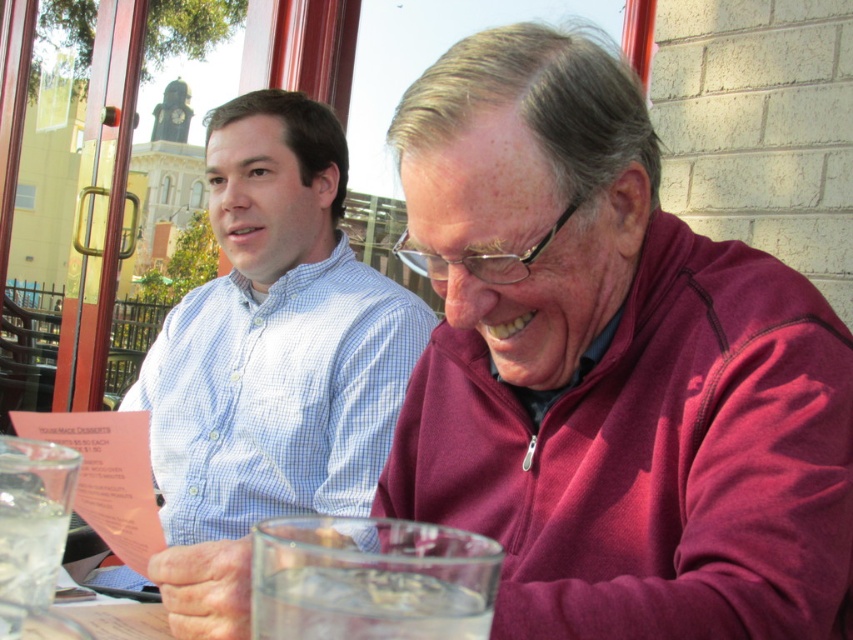
You are standing in the room where the two people are sitting. You want to look out the window to see the clock tower. Which direction should you look relative to the point at location (366, 604)?

The point at location (366, 604) is on clear glass water at lower center. To see the clock tower outside through the window, you should look upward from the point at location (366, 604) since the window is above and the clock tower is in the background beyond the window.

You are a photographer taking a picture of the light blue checkered shirt at center and the clear glass water at lower center. Which object should you focus on first if you want to capture both in the same frame without moving the camera?

The light blue checkered shirt at center is positioned on the left side of clear glass water at lower center, so you should focus on the light blue checkered shirt at center first to ensure both are in frame.